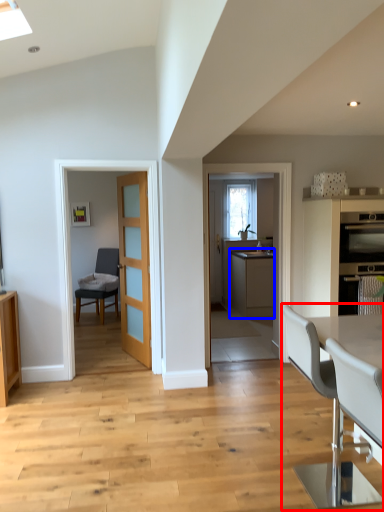
Question: Which object appears closest to the camera in this image, chair (highlighted by a red box) or cabinetry (highlighted by a blue box)?

Choices:
 (A) chair
 (B) cabinetry

Answer: (A)